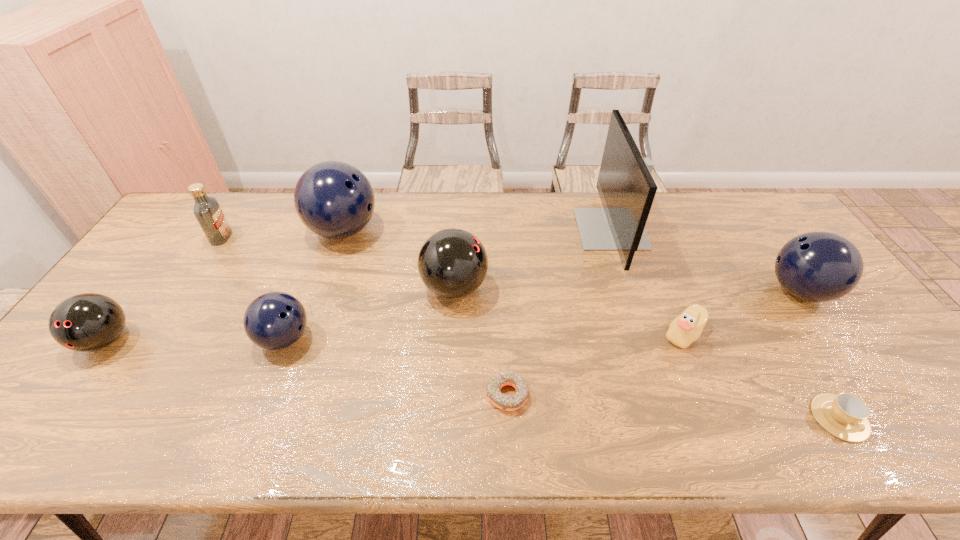
Find the location of `the nearest blue bowling ball`. the nearest blue bowling ball is located at coordinates (275, 320).

Identify the location of beige duck. This screenshot has width=960, height=540. tap(686, 328).

The height and width of the screenshot is (540, 960). Find the location of `duck`. duck is located at coordinates (686, 328).

Image resolution: width=960 pixels, height=540 pixels. I want to click on the ninth tallest object, so click(845, 415).

Where is `cup`? cup is located at coordinates (845, 415).

At what (x,y) coordinates should I click in order to perform the action: click on the shortest object. Please return your answer as a coordinate pair (x, y). The image size is (960, 540). Looking at the image, I should click on (505, 402).

The height and width of the screenshot is (540, 960). Identify the location of chocolate doughnut. (505, 402).

At what (x,y) coordinates should I click in order to perform the action: click on vacant space located 0.270m on the screen of the tallest object. Please return your answer as a coordinate pair (x, y). The width and height of the screenshot is (960, 540). Looking at the image, I should click on (496, 229).

In order to click on free region located 0.190m on the screen of the tallest object in this screenshot , I will do `click(520, 229)`.

Identify the location of vacant space positioned on the screen of the tallest object. (481, 229).